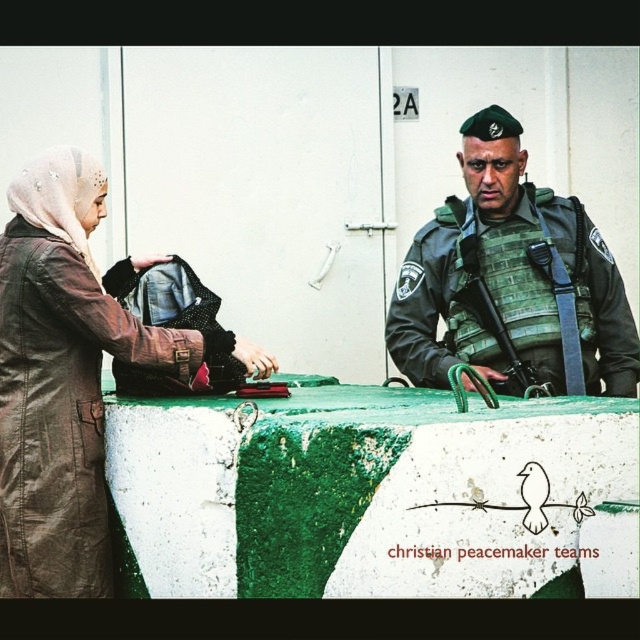
Can you confirm if brown leather jacket at left is positioned to the right of green textured rifle at center?

In fact, brown leather jacket at left is to the left of green textured rifle at center.

Which is behind, point (189, 340) or point (500, 353)?

Point (500, 353)

What do you see at coordinates (68, 376) in the screenshot?
I see `brown leather jacket at left` at bounding box center [68, 376].

Image resolution: width=640 pixels, height=640 pixels. What are the coordinates of `brown leather jacket at left` in the screenshot? It's located at (68, 376).

Is brown leather jacket at left wider than green military uniform at right?

In fact, brown leather jacket at left might be narrower than green military uniform at right.

This screenshot has height=640, width=640. I want to click on brown leather jacket at left, so click(68, 376).

Which is in front, point (572, 282) or point (493, 330)?

Positioned in front is point (493, 330).

Between green military uniform at right and green textured rifle at center, which one appears on the left side from the viewer's perspective?

From the viewer's perspective, green textured rifle at center appears more on the left side.

Who is more distant from viewer, (532, 227) or (508, 337)?

The point (532, 227) is more distant.

I want to click on green military uniform at right, so click(x=512, y=282).